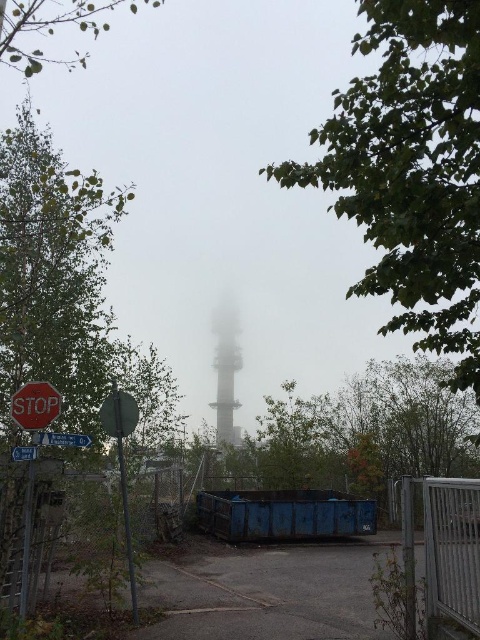
Can you confirm if green leafy tree at left is taller than smooth gray tower at center?

Correct, green leafy tree at left is much taller as smooth gray tower at center.

Does point (24, 216) lie in front of point (219, 332)?

Yes, point (24, 216) is closer to viewer.

This screenshot has width=480, height=640. Identify the location of green leafy tree at left. (67, 292).

The image size is (480, 640). What are the coordinates of `green leafy tree at left` in the screenshot? It's located at (67, 292).

What do you see at coordinates (35, 404) in the screenshot? The width and height of the screenshot is (480, 640). I see `red matte stop sign at lower left` at bounding box center [35, 404].

Which is behind, point (45, 403) or point (90, 442)?

The point (90, 442) is behind.

Does point (24, 401) come closer to viewer compared to point (84, 444)?

Yes, it is in front of point (84, 444).

You are a GUI agent. You are given a task and a screenshot of the screen. Output one action in this format:
    pyautogui.click(x=<x>, y=<y>)
    Task: Click on the red matte stop sign at lower left
    This screenshot has width=480, height=640.
    Given the screenshot: What is the action you would take?
    pyautogui.click(x=35, y=404)

Find the location of `smooth gray tower at center`. smooth gray tower at center is located at coordinates (226, 371).

Between point (233, 337) and point (28, 456), which one is positioned behind?

Positioned behind is point (233, 337).

Is point (238, 333) positioned after point (12, 452)?

Yes.

Find the location of a particular element. This screenshot has height=640, width=480. smooth gray tower at center is located at coordinates (226, 371).